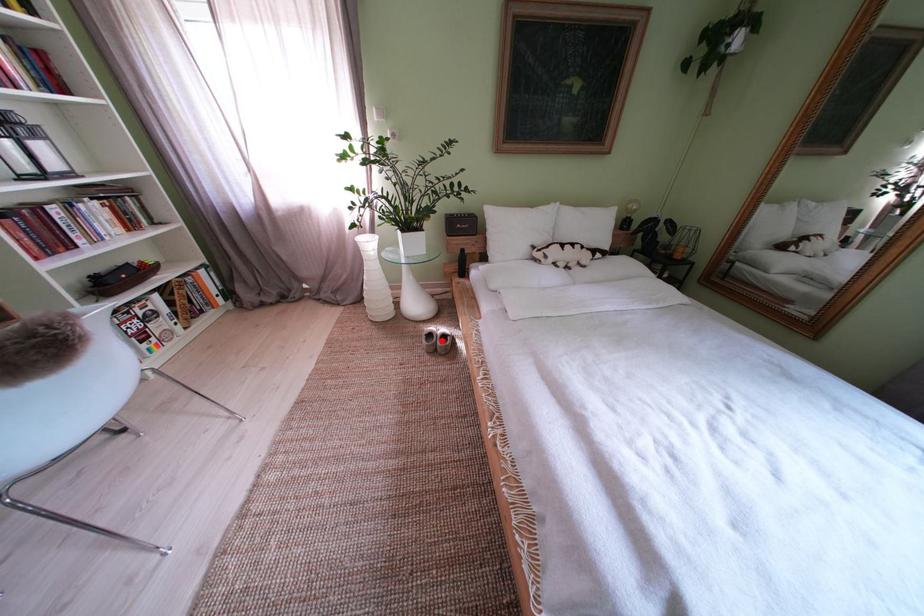
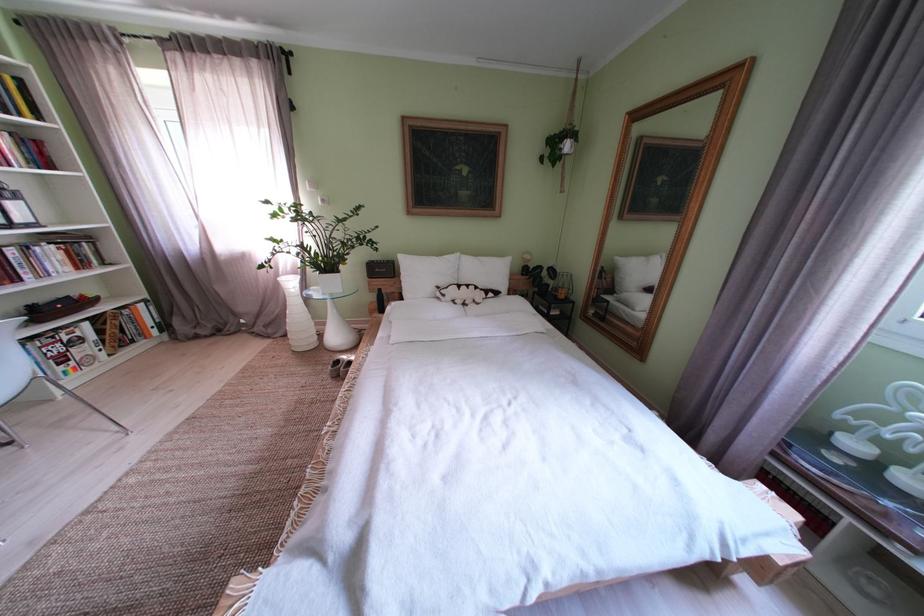
Question: I am providing you with two images of the same scene from different viewpoints. A red point is shown in image1. For the corresponding object point in image2, is it positioned nearer or farther from the camera?

Choices:
 (A) Nearer
 (B) Farther

Answer: (B)